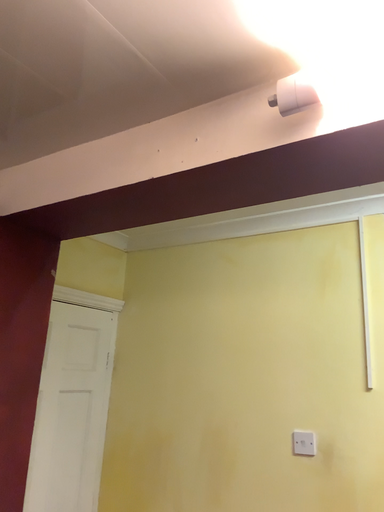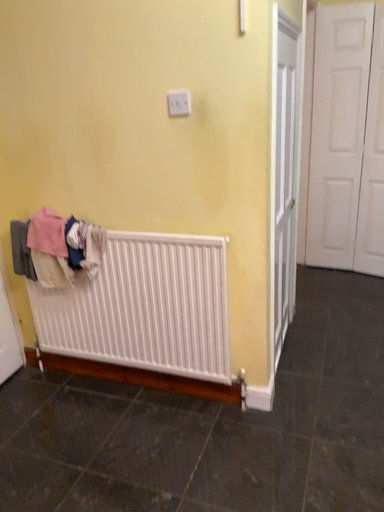
Question: How did the camera likely rotate when shooting the video?

Choices:
 (A) rotated upward
 (B) rotated downward

Answer: (B)